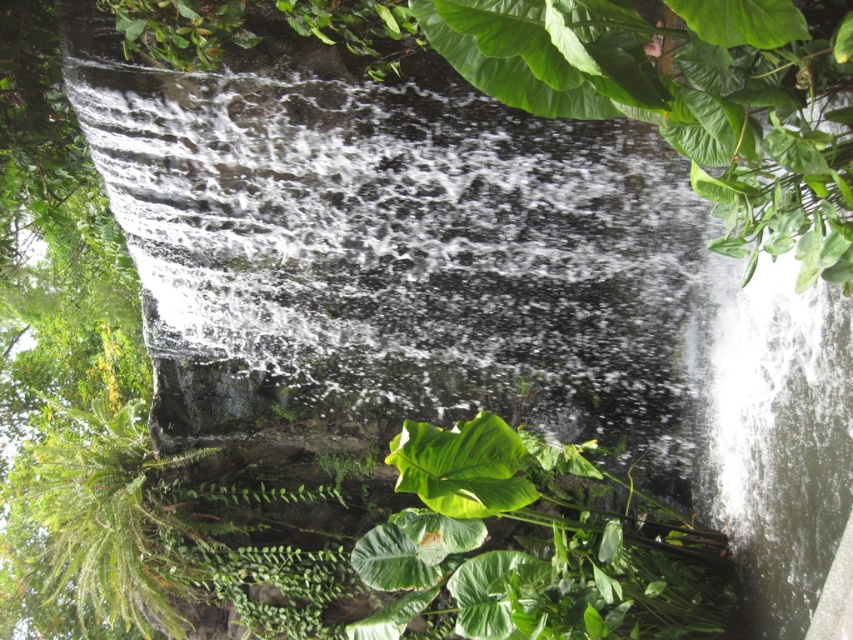
Question: Which point is closer to the camera?

Choices:
 (A) green leafy plant at center
 (B) green fuzzy fern at lower left

Answer: (A)

Question: Which object is closer to the camera taking this photo?

Choices:
 (A) green fuzzy fern at lower left
 (B) green leafy plant at center

Answer: (B)

Question: Can you confirm if green leafy plant at center is positioned to the left of green fuzzy fern at lower left?

Choices:
 (A) yes
 (B) no

Answer: (B)

Question: Is green leafy plant at center bigger than green fuzzy fern at lower left?

Choices:
 (A) no
 (B) yes

Answer: (A)

Question: In this image, where is green leafy plant at center located relative to green fuzzy fern at lower left?

Choices:
 (A) left
 (B) right

Answer: (B)